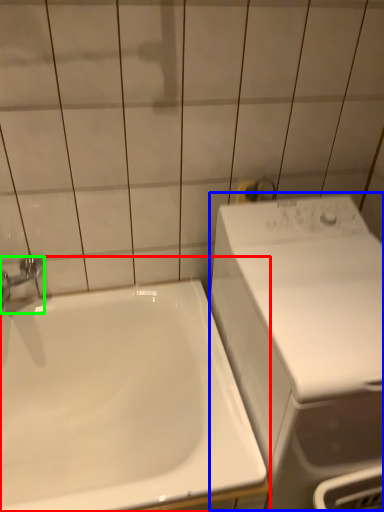
Question: Which is nearer to the sink (highlighted by a red box)? washing machine (highlighted by a blue box) or tap (highlighted by a green box).

Choices:
 (A) washing machine
 (B) tap

Answer: (A)